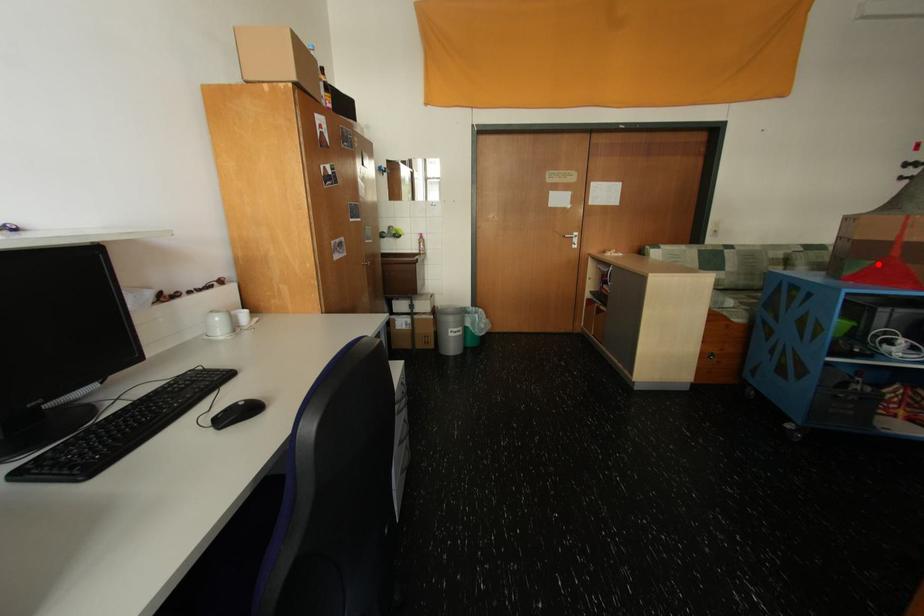
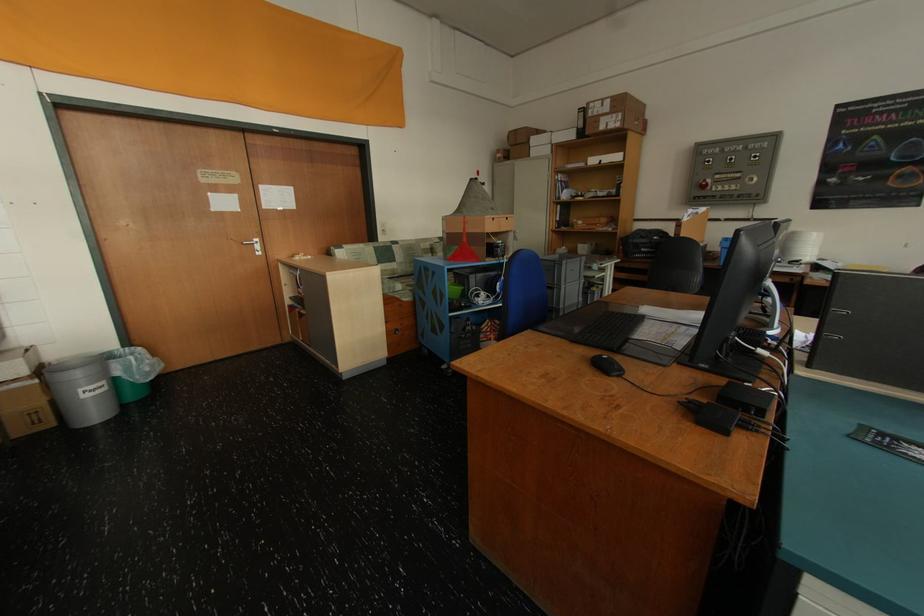
Question: I am providing you with two images of the same scene from different viewpoints. Given a red point in image1, look at the same physical point in image2. Is it:

Choices:
 (A) Closer to the viewpoint
 (B) Farther from the viewpoint

Answer: (A)